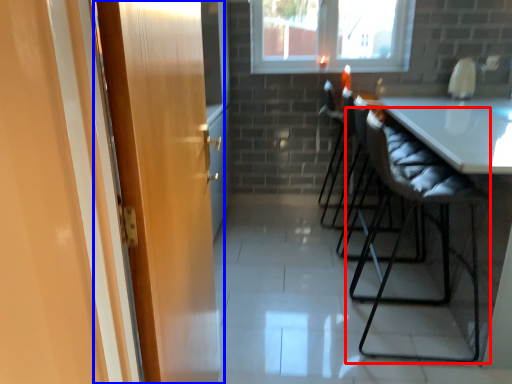
Question: Which object is further to the camera taking this photo, chair (highlighted by a red box) or door (highlighted by a blue box)?

Choices:
 (A) chair
 (B) door

Answer: (A)